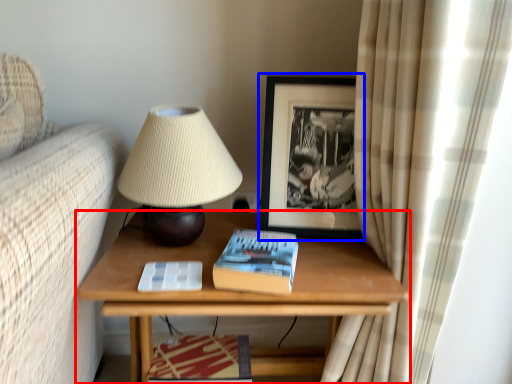
Question: Which object appears closest to the camera in this image, table (highlighted by a red box) or picture frame (highlighted by a blue box)?

Choices:
 (A) table
 (B) picture frame

Answer: (A)